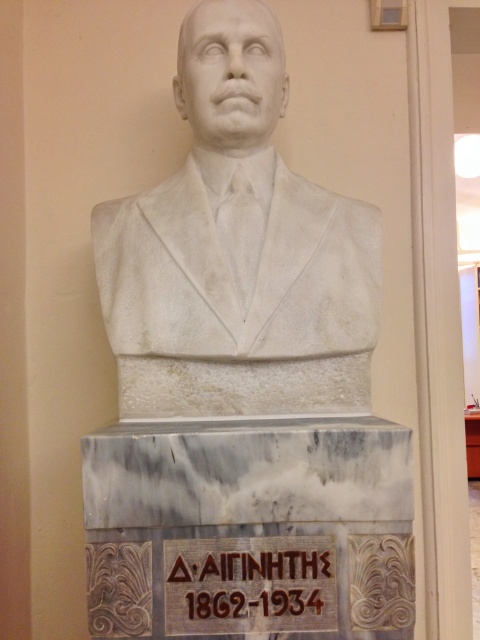
Consider the image. You are standing in front of a historical monument. You want to take a photo of the white marble bust at center. If your camera can focus on objects up to 5 feet away, will you need to step back to get a clear shot?

The white marble bust at center is 5.39 feet away from viewer. Since the camera can focus up to 5 feet, you need to step back to ensure the distance is within the camera range.

You are standing in front of the marble bust and pedestal. You notice two points marked on the pedestal. One is at coordinate point (x=143, y=403) and the other at point (x=334, y=582). Which point is closer to you?

Point (x=334, y=582) is closer to you because point (x=143, y=403) is behind it.